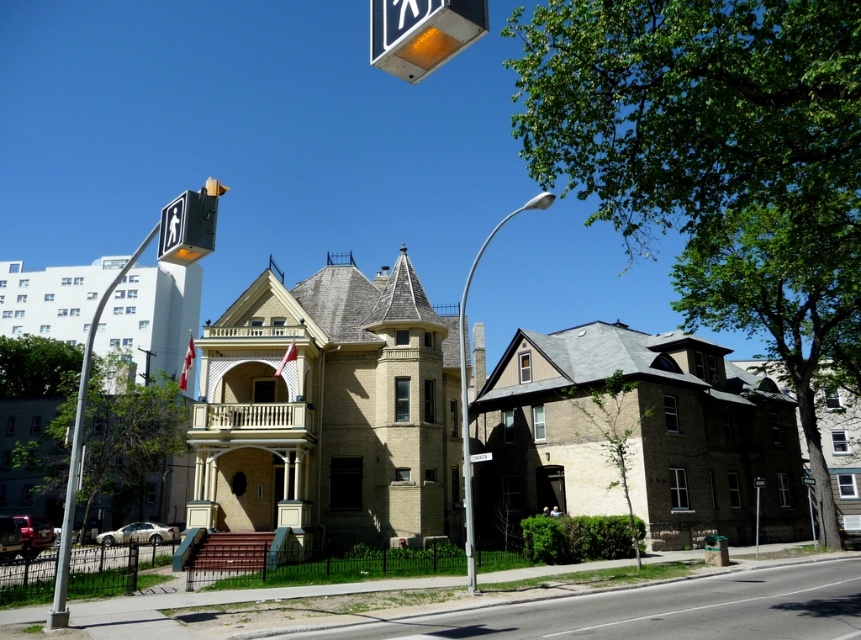
You are a pedestrian waiting at a crosswalk in front of the Victorian house. You see the yellow plastic pedestrian signal at upper left and the brushed metal pedestrian crossing sign at upper center. Which one is positioned higher above the other?

The yellow plastic pedestrian signal at upper left is located above the brushed metal pedestrian crossing sign at upper center.

You are a pedestrian waiting at the crosswalk near the Victorian house. You see the silver metallic pole at left and the yellow plastic pedestrian signal at upper left. Which object is positioned higher from the ground?

The silver metallic pole at left is located above the yellow plastic pedestrian signal at upper left, so it is positioned higher from the ground.